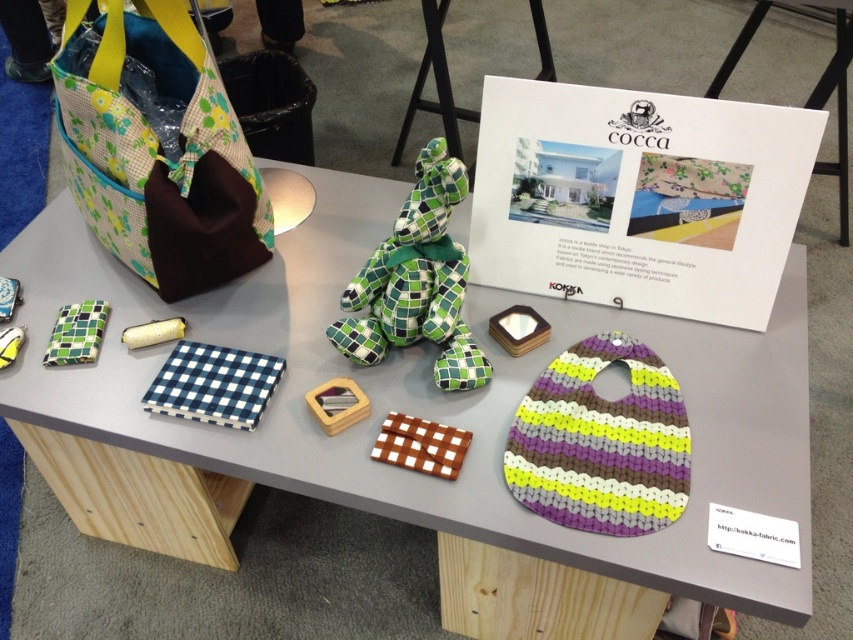
Question: Can you confirm if green plaid fabric bag at left is wider than blue checkered fabric at center?

Choices:
 (A) yes
 (B) no

Answer: (A)

Question: Is green checkered fabric stuffed animal at center positioned behind yellow fabric roll at center?

Choices:
 (A) no
 (B) yes

Answer: (A)

Question: Which point is closer to the camera taking this photo?

Choices:
 (A) (637, 500)
 (B) (177, 380)
 (C) (61, 316)

Answer: (A)

Question: Which of the following is the farthest from the observer?

Choices:
 (A) (349, 374)
 (B) (548, 484)
 (C) (55, 352)

Answer: (C)

Question: Among these points, which one is farthest from the camera?

Choices:
 (A) (445, 333)
 (B) (622, 493)
 (C) (717, 476)

Answer: (A)

Question: Is yellow fabric roll at center in front of yellow fabric toy at center?

Choices:
 (A) no
 (B) yes

Answer: (A)